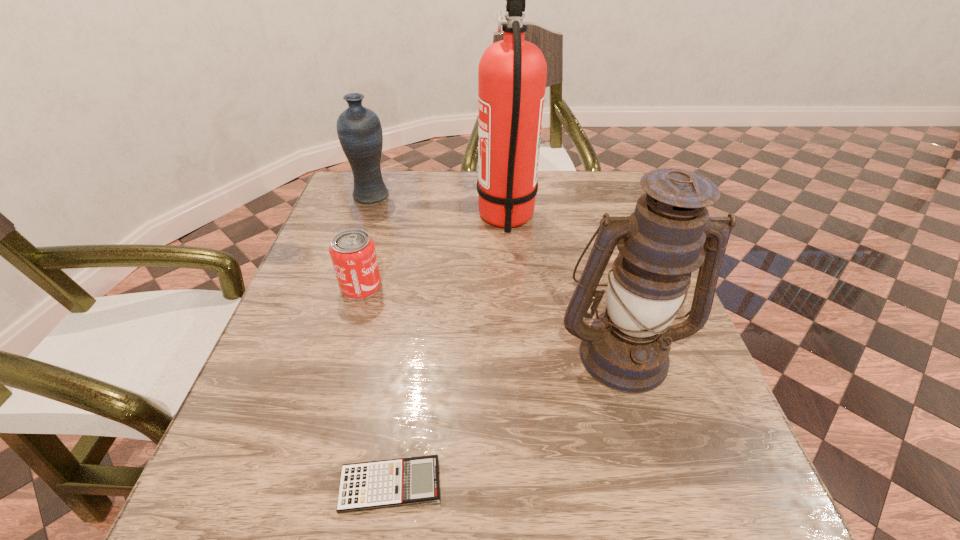
Locate an element on the screen. This screenshot has width=960, height=540. free region located on the handle side of the tallest object is located at coordinates (361, 219).

Image resolution: width=960 pixels, height=540 pixels. Identify the location of vacant area located on the back of the second nearest object. pos(579,210).

Identify the location of vacant region located on the right of the third shortest object. (514, 195).

The width and height of the screenshot is (960, 540). What are the coordinates of `vacant space located 0.400m on the front of the third farthest object` in the screenshot? It's located at (301, 494).

In order to click on vacant space located 0.230m on the back of the nearest object in this screenshot , I will do `click(412, 344)`.

Locate an element on the screen. This screenshot has height=540, width=960. fire extinguisher located in the far edge section of the desktop is located at coordinates (512, 73).

Find the location of `vase that is at the far edge`. vase that is at the far edge is located at coordinates (359, 130).

The height and width of the screenshot is (540, 960). Identify the location of object that is at the near edge. (382, 484).

Identify the location of vase situated at the left edge. (359, 130).

Where is `can present at the left edge`? This screenshot has width=960, height=540. can present at the left edge is located at coordinates (352, 251).